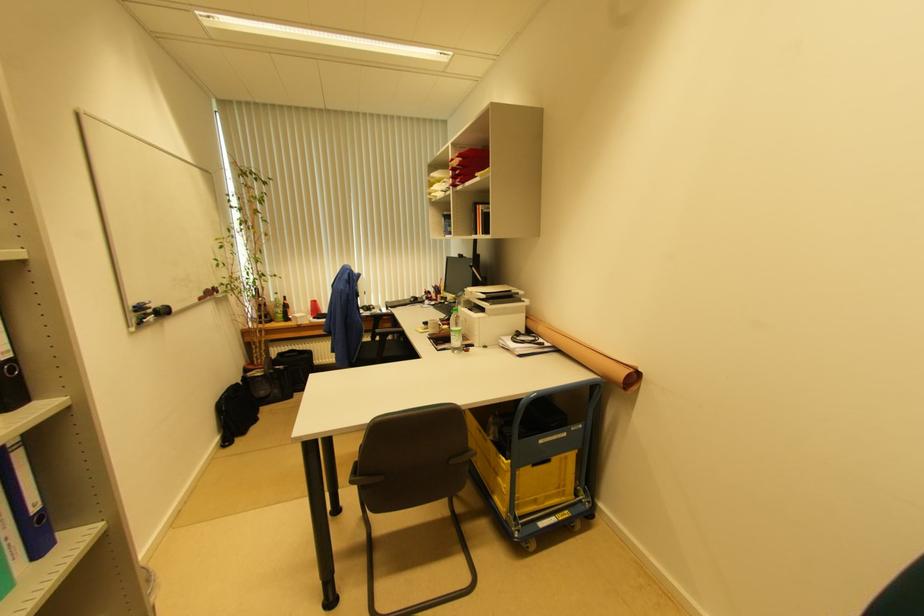
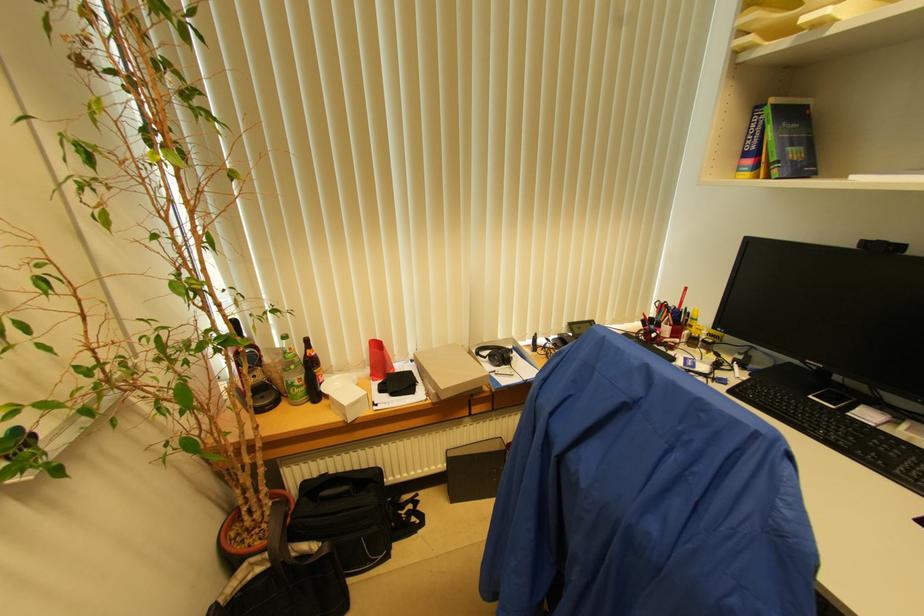
Where in the second image is the point corresponding to the point at 284,313 from the first image?

(304, 379)